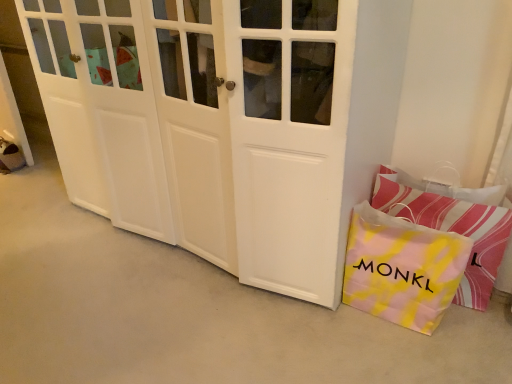
Question: Is pink striped pillow at lower right closer to the viewer compared to white matte door at center?

Choices:
 (A) no
 (B) yes

Answer: (A)

Question: From the image's perspective, is pink striped pillow at lower right on top of white matte door at center?

Choices:
 (A) yes
 (B) no

Answer: (B)

Question: Does pink striped pillow at lower right come behind white matte door at center?

Choices:
 (A) no
 (B) yes

Answer: (B)

Question: Is pink striped pillow at lower right turned away from white matte door at center?

Choices:
 (A) no
 (B) yes

Answer: (A)

Question: From a real-world perspective, is pink striped pillow at lower right positioned over white matte door at center based on gravity?

Choices:
 (A) no
 (B) yes

Answer: (A)

Question: Is white matte door at center completely or partially inside pink striped pillow at lower right?

Choices:
 (A) yes
 (B) no

Answer: (B)

Question: Can you confirm if white matte door at center is wider than pink striped pillow at lower right?

Choices:
 (A) yes
 (B) no

Answer: (A)

Question: Considering the relative sizes of white matte door at center and pink striped pillow at lower right in the image provided, is white matte door at center thinner than pink striped pillow at lower right?

Choices:
 (A) yes
 (B) no

Answer: (B)

Question: Does white matte door at center have a lesser height compared to pink striped pillow at lower right?

Choices:
 (A) yes
 (B) no

Answer: (B)

Question: Is white matte door at center taller than pink striped pillow at lower right?

Choices:
 (A) no
 (B) yes

Answer: (B)

Question: Considering the relative positions of white matte door at center and pink striped pillow at lower right in the image provided, is white matte door at center to the right of pink striped pillow at lower right from the viewer's perspective?

Choices:
 (A) no
 (B) yes

Answer: (A)

Question: From a real-world perspective, is white matte door at center on top of pink striped pillow at lower right?

Choices:
 (A) no
 (B) yes

Answer: (B)

Question: Can you confirm if yellow tie-dye paper bag at lower right is wider than white matte door at center?

Choices:
 (A) no
 (B) yes

Answer: (A)